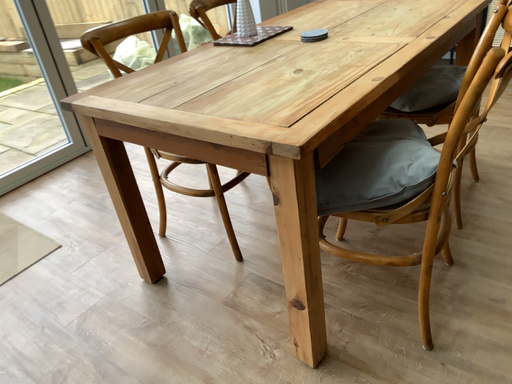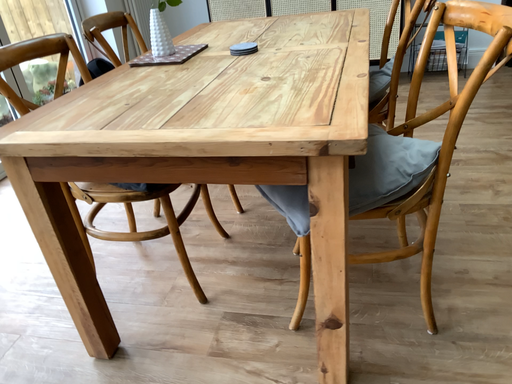
Question: Which way did the camera rotate in the video?

Choices:
 (A) rotated right
 (B) rotated left

Answer: (A)